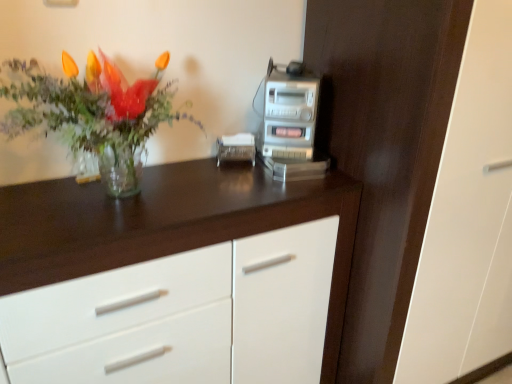
Question: From the image's perspective, would you say dark wood dresser at center is shown under transparent glass vase at left?

Choices:
 (A) no
 (B) yes

Answer: (B)

Question: Considering the relative sizes of dark wood dresser at center and transparent glass vase at left in the image provided, is dark wood dresser at center wider than transparent glass vase at left?

Choices:
 (A) no
 (B) yes

Answer: (B)

Question: Is dark wood dresser at center far from transparent glass vase at left?

Choices:
 (A) no
 (B) yes

Answer: (A)

Question: Considering the relative positions of dark wood dresser at center and transparent glass vase at left in the image provided, is dark wood dresser at center in front of transparent glass vase at left?

Choices:
 (A) yes
 (B) no

Answer: (B)

Question: Is dark wood dresser at center at the right side of transparent glass vase at left?

Choices:
 (A) yes
 (B) no

Answer: (A)

Question: Can you confirm if dark wood dresser at center is taller than transparent glass vase at left?

Choices:
 (A) yes
 (B) no

Answer: (A)

Question: Is transparent glass vase at left outside silver metallic stereo at upper right?

Choices:
 (A) yes
 (B) no

Answer: (A)

Question: Does transparent glass vase at left have a greater width compared to silver metallic stereo at upper right?

Choices:
 (A) yes
 (B) no

Answer: (A)

Question: From the image's perspective, is transparent glass vase at left beneath silver metallic stereo at upper right?

Choices:
 (A) yes
 (B) no

Answer: (A)

Question: Does transparent glass vase at left come in front of silver metallic stereo at upper right?

Choices:
 (A) no
 (B) yes

Answer: (B)

Question: Is transparent glass vase at left to the right of silver metallic stereo at upper right from the viewer's perspective?

Choices:
 (A) no
 (B) yes

Answer: (A)

Question: Is transparent glass vase at left aimed at silver metallic stereo at upper right?

Choices:
 (A) yes
 (B) no

Answer: (B)

Question: Would you consider silver metallic stereo at upper right to be distant from dark wood dresser at center?

Choices:
 (A) no
 (B) yes

Answer: (A)